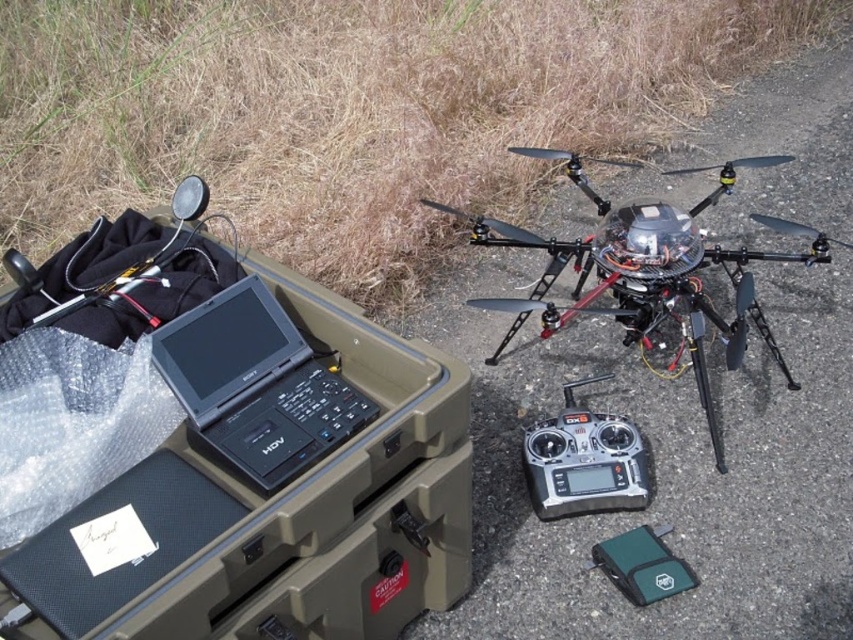
Is point (682, 269) behind point (154, 346)?

Yes, it is.

Who is more forward, (x=509, y=236) or (x=242, y=324)?

Point (x=242, y=324) is more forward.

The width and height of the screenshot is (853, 640). What are the coordinates of `metallic black drone at center-right` in the screenshot? It's located at (648, 269).

Where is `metallic black drone at center-right`? Image resolution: width=853 pixels, height=640 pixels. metallic black drone at center-right is located at coordinates (648, 269).

Does metallic black drone at center-right appear on the right side of black plastic remote control at center?

Indeed, metallic black drone at center-right is positioned on the right side of black plastic remote control at center.

Which is in front, point (579, 240) or point (540, 480)?

Positioned in front is point (540, 480).

This screenshot has height=640, width=853. I want to click on metallic black drone at center-right, so click(x=648, y=269).

Is black matte laptop at center to the left of black plastic remote control at center from the viewer's perspective?

Correct, you'll find black matte laptop at center to the left of black plastic remote control at center.

Can you confirm if black matte laptop at center is positioned above black plastic remote control at center?

Yes, black matte laptop at center is above black plastic remote control at center.

Is point (260, 396) closer to camera compared to point (567, 412)?

Yes.

Locate an element on the screen. This screenshot has height=640, width=853. black matte laptop at center is located at coordinates (256, 385).